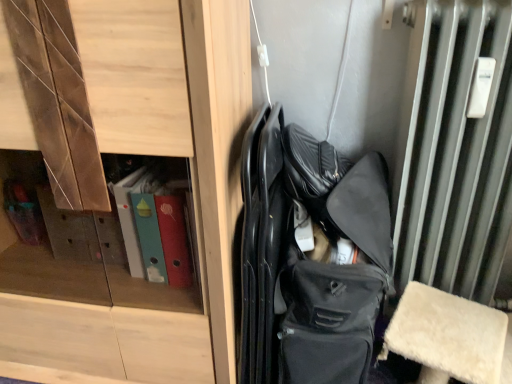
Question: Considering the positions of matte black bag at center and wooden cabinet at center in the image, is matte black bag at center wider or thinner than wooden cabinet at center?

Choices:
 (A) wide
 (B) thin

Answer: (B)

Question: Is point (309, 329) positioned closer to the camera than point (59, 301)?

Choices:
 (A) closer
 (B) farther

Answer: (A)

Question: From the image's perspective, is matte black bag at center above or below wooden cabinet at center?

Choices:
 (A) below
 (B) above

Answer: (A)

Question: Looking at the image, does wooden cabinet at center seem bigger or smaller compared to matte black bag at center?

Choices:
 (A) big
 (B) small

Answer: (A)

Question: In the image, is wooden cabinet at center positioned in front of or behind matte black bag at center?

Choices:
 (A) behind
 (B) front

Answer: (B)

Question: From a real-world perspective, is wooden cabinet at center positioned above or below matte black bag at center?

Choices:
 (A) above
 (B) below

Answer: (A)

Question: Considering the positions of point (28, 276) and point (371, 221), is point (28, 276) closer or farther from the camera than point (371, 221)?

Choices:
 (A) closer
 (B) farther

Answer: (B)